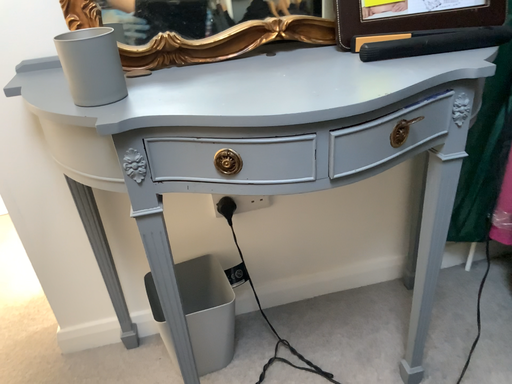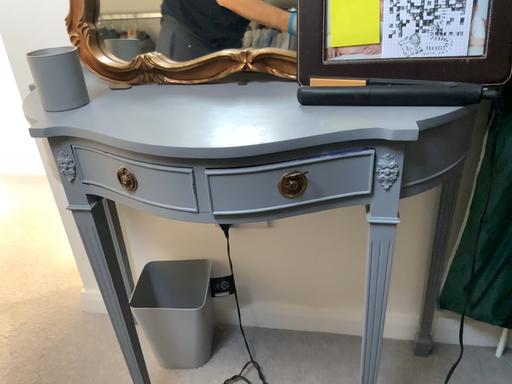
Question: How did the camera likely rotate when shooting the video?

Choices:
 (A) rotated left
 (B) rotated right

Answer: (A)